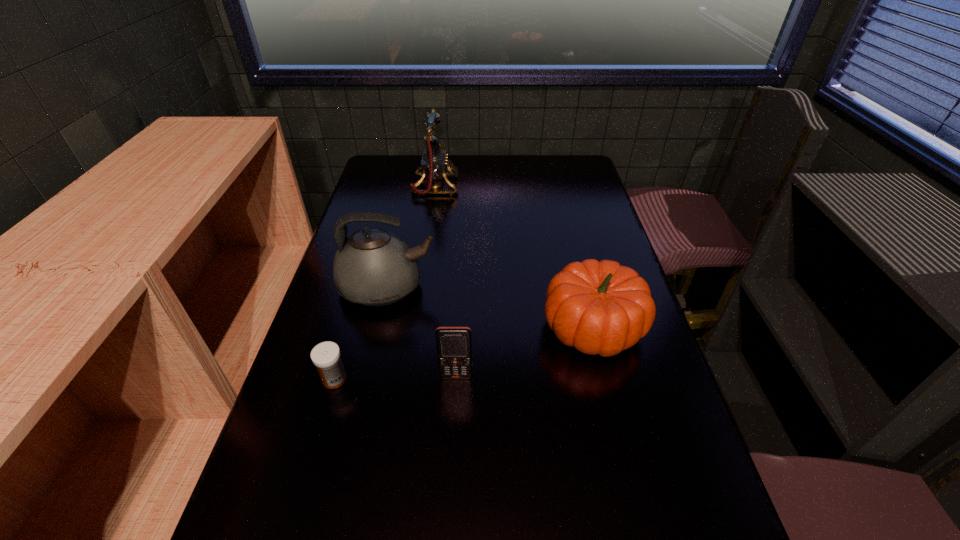
At what (x,y) coordinates should I click in order to perform the action: click on object that is at the far edge. Please return your answer as a coordinate pair (x, y). The height and width of the screenshot is (540, 960). Looking at the image, I should click on (434, 161).

Identify the location of kettle located at the left edge. Image resolution: width=960 pixels, height=540 pixels. (373, 267).

The width and height of the screenshot is (960, 540). Find the location of `medicine that is at the left edge`. medicine that is at the left edge is located at coordinates (326, 356).

Locate an element on the screen. This screenshot has width=960, height=540. object that is at the right edge is located at coordinates (602, 308).

The image size is (960, 540). In the image, there is a desktop. Find the location of `vacant space at the far edge`. vacant space at the far edge is located at coordinates (486, 181).

In the image, there is a desktop. Where is `vacant space at the left edge`? vacant space at the left edge is located at coordinates (360, 201).

Locate an element on the screen. free location at the right edge of the desktop is located at coordinates (624, 382).

Where is `vacant point at the far left corner`? This screenshot has width=960, height=540. vacant point at the far left corner is located at coordinates (410, 165).

Locate an element on the screen. blank region between the telephone and the cellular telephone is located at coordinates (445, 281).

The image size is (960, 540). Find the location of `free space that is in between the telephone and the cellular telephone`. free space that is in between the telephone and the cellular telephone is located at coordinates (445, 281).